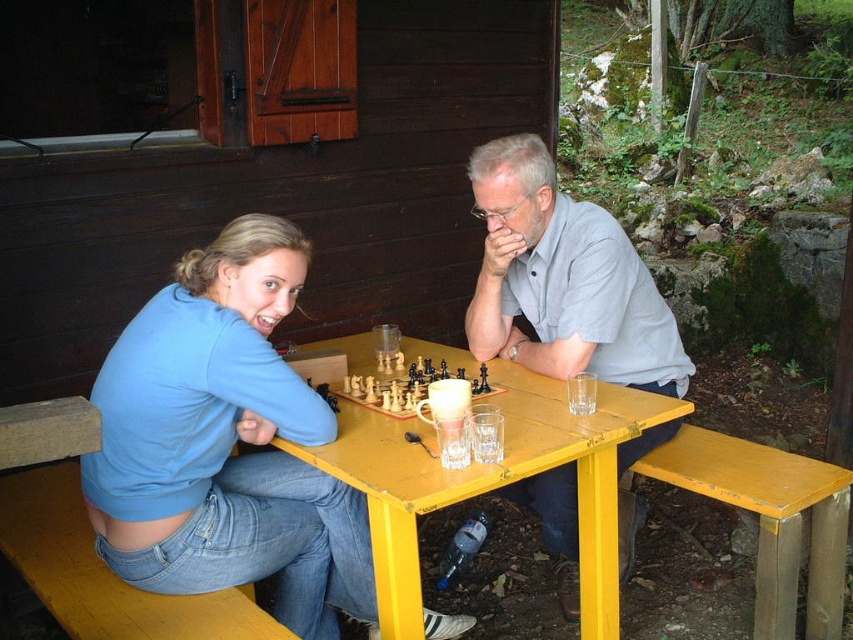
Question: Among these objects, which one is nearest to the camera?

Choices:
 (A) yellow wood table at center
 (B) gray cotton shirt at center

Answer: (A)

Question: Is yellow wood table at center further to camera compared to wooden chess set at center?

Choices:
 (A) no
 (B) yes

Answer: (A)

Question: Which object appears closest to the camera in this image?

Choices:
 (A) gray cotton shirt at center
 (B) yellow wood table at center
 (C) wooden chess set at center

Answer: (B)

Question: Is gray cotton shirt at center positioned before yellow wood table at center?

Choices:
 (A) yes
 (B) no

Answer: (B)

Question: Considering the real-world distances, which object is farthest from the wooden chess set at center?

Choices:
 (A) gray cotton shirt at center
 (B) yellow wood table at center
 (C) blue cotton shirt at left

Answer: (C)

Question: Is blue cotton shirt at left thinner than wooden chess set at center?

Choices:
 (A) yes
 (B) no

Answer: (B)